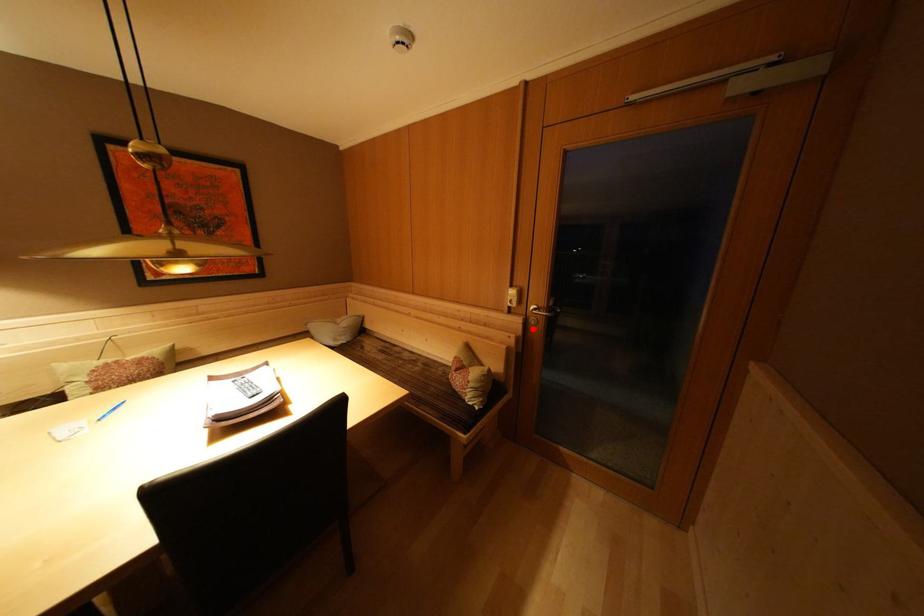
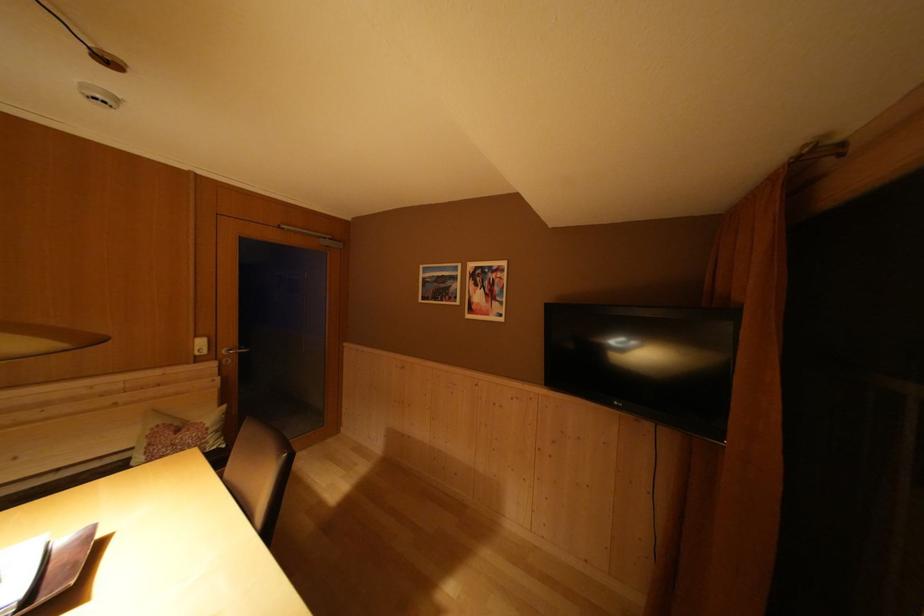
Find the pixel in the second image that matches the highlighted location in the first image.

(226, 371)